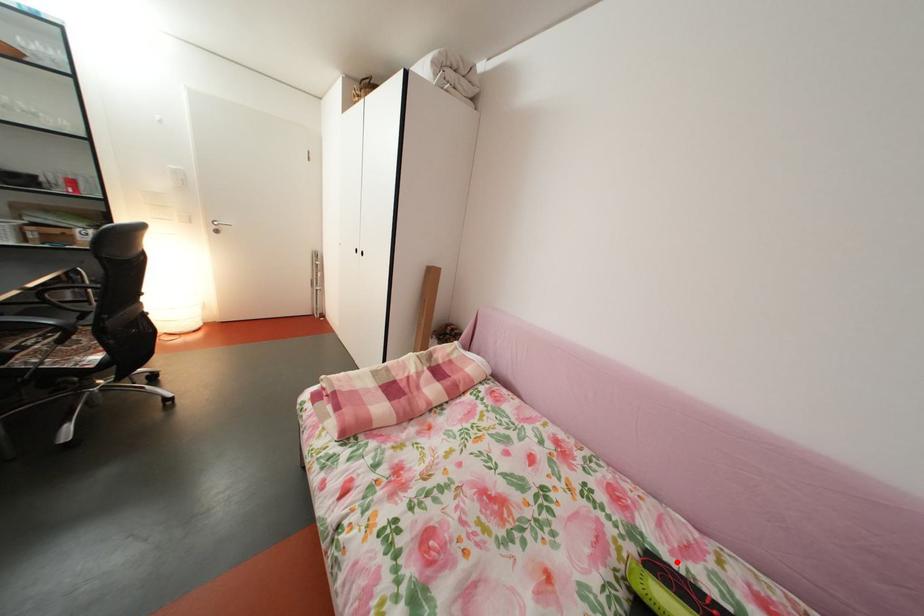
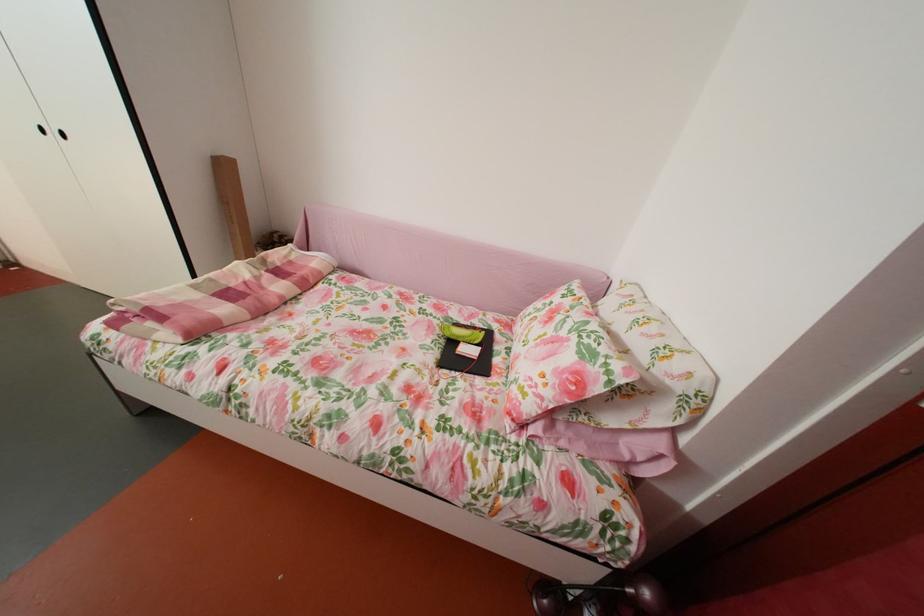
In the second image, find the point that corresponds to the highlighted location in the first image.

(473, 328)